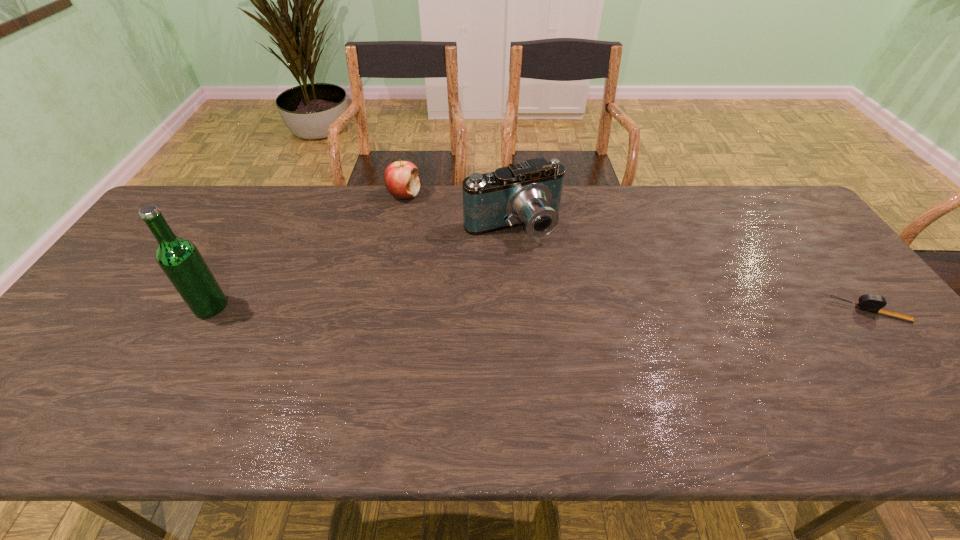
The image size is (960, 540). I want to click on the leftmost object, so click(x=180, y=260).

Where is `beer bottle`? beer bottle is located at coordinates (180, 260).

The height and width of the screenshot is (540, 960). Find the location of `tape measure`. tape measure is located at coordinates (873, 303).

This screenshot has width=960, height=540. In order to click on the shortest object in this screenshot , I will do `click(873, 303)`.

This screenshot has height=540, width=960. Identify the location of the third shortest object. (529, 193).

Locate an element on the screen. Image resolution: width=960 pixels, height=540 pixels. the second object from right to left is located at coordinates (529, 193).

Identify the location of the second object from left to right. This screenshot has width=960, height=540. (401, 179).

Where is `the third tallest object`? Image resolution: width=960 pixels, height=540 pixels. the third tallest object is located at coordinates (401, 179).

Where is `vacant space located 0.120m on the right of the leftmost object`? The width and height of the screenshot is (960, 540). vacant space located 0.120m on the right of the leftmost object is located at coordinates (273, 306).

Find the location of `free region located on the front of the rightmost object`. free region located on the front of the rightmost object is located at coordinates (933, 391).